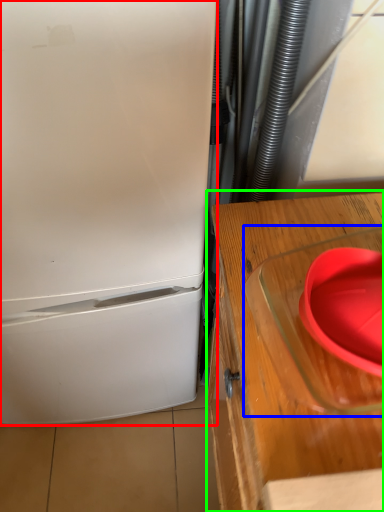
Question: Which object is the closest to the refrigerator (highlighted by a red box)? Choose among these: appliance (highlighted by a blue box) or table (highlighted by a green box).

Choices:
 (A) appliance
 (B) table

Answer: (B)